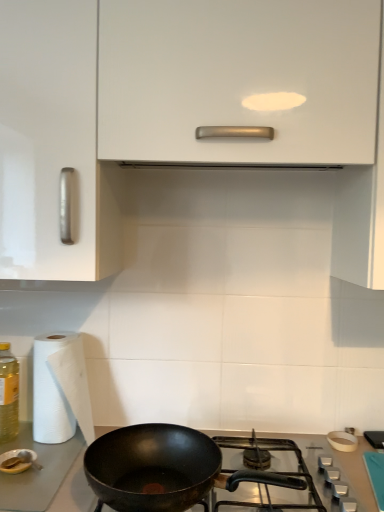
The height and width of the screenshot is (512, 384). I want to click on vacant space to the right of translucent yellow bottle at left, so click(x=47, y=450).